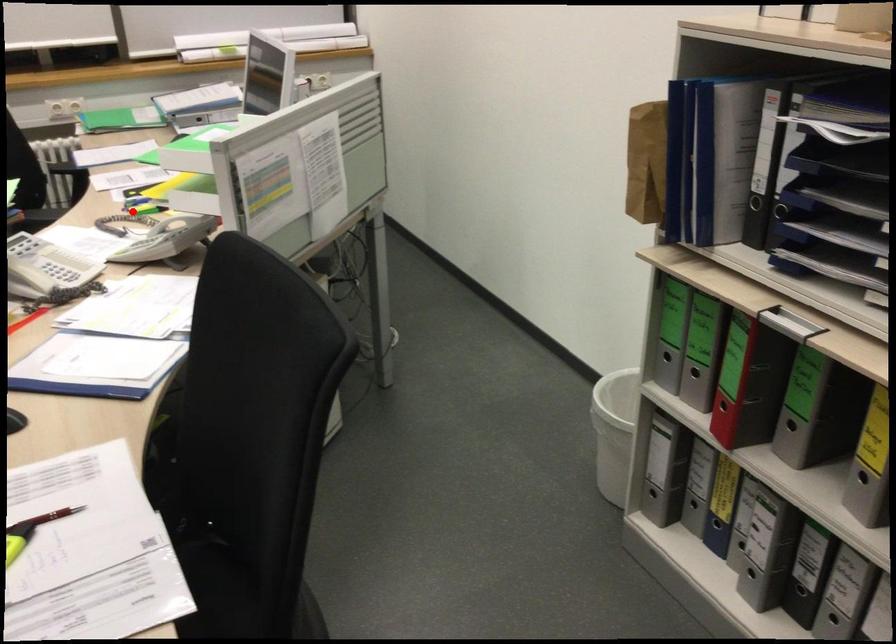
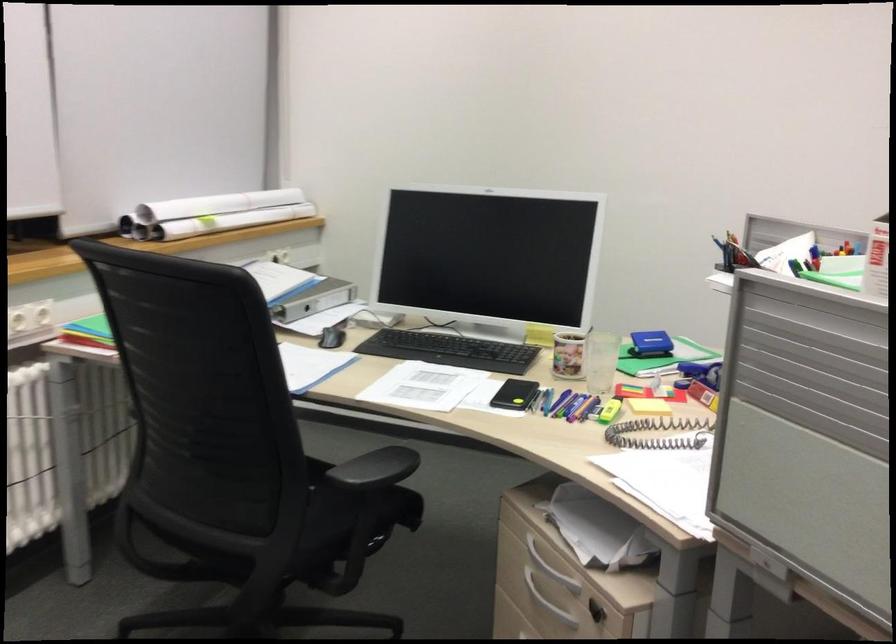
Question: A red point is marked in image1. In image2, is the corresponding 3D point closer to the camera or farther? Reply with the corresponding letter.

Choices:
 (A) The corresponding 3D point is closer.
 (B) The corresponding 3D point is farther.

Answer: (A)